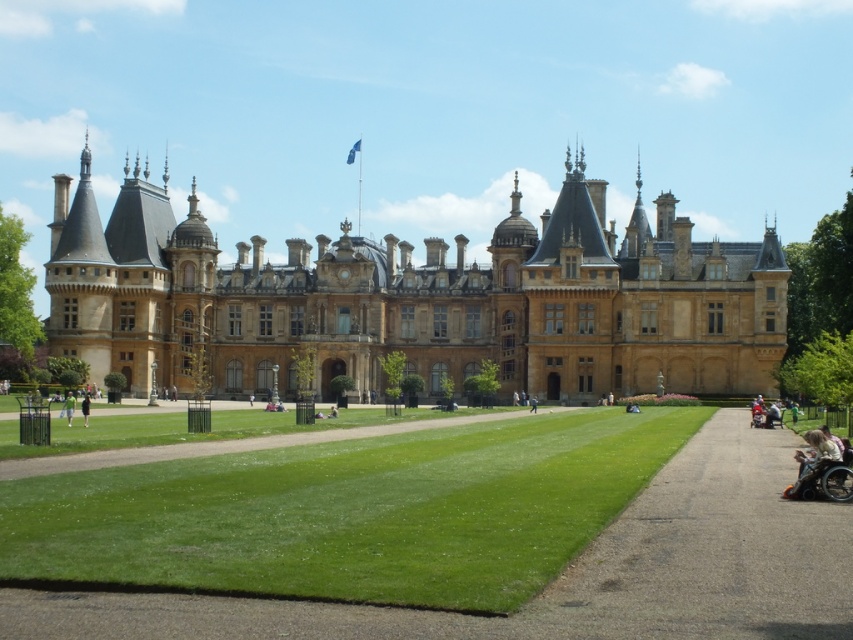
Image resolution: width=853 pixels, height=640 pixels. Identify the location of golden stone castle at center. (418, 298).

Which of these two, golden stone castle at center or dark brown leather jacket at center, stands shorter?

dark brown leather jacket at center is shorter.

This screenshot has width=853, height=640. I want to click on golden stone castle at center, so click(x=418, y=298).

Between light brown fabric wheelchair at lower right and dark brown leather jacket at center, which one appears on the right side from the viewer's perspective?

Positioned to the right is light brown fabric wheelchair at lower right.

Is point (799, 481) less distant than point (80, 410)?

Yes, point (799, 481) is in front of point (80, 410).

Find the location of a particular element. This screenshot has width=853, height=640. light brown fabric wheelchair at lower right is located at coordinates (816, 451).

Between point (413, 500) and point (637, 577), which one is positioned behind?

The point (413, 500) is more distant.

Is green grass at center in front of smooth asphalt path at lower right?

No.

Between point (225, 468) and point (767, 561), which one is positioned in front?

Point (767, 561) is in front.

The image size is (853, 640). I want to click on green grass at center, so click(x=349, y=513).